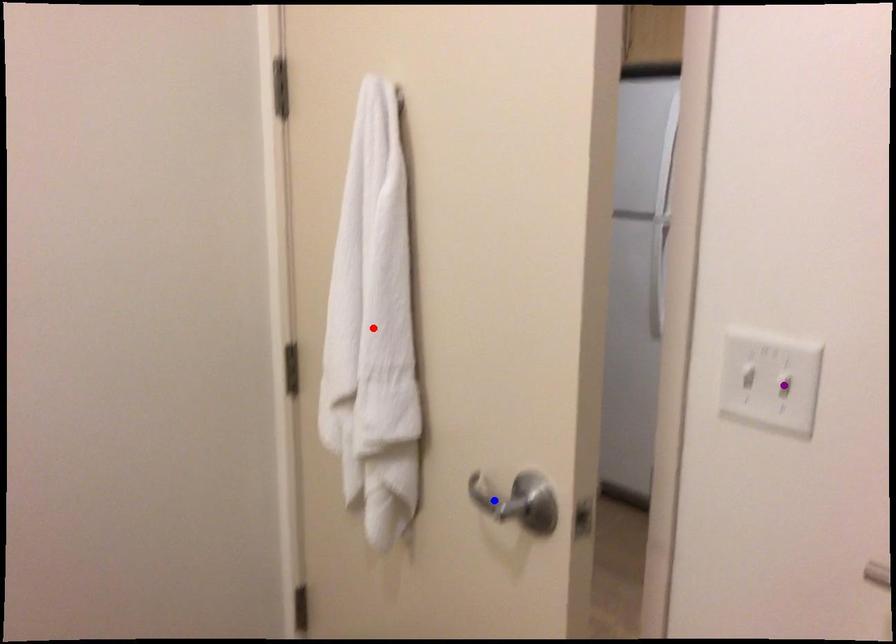
Order these from nearest to farthest:
- purple point
- red point
- blue point

purple point < blue point < red point